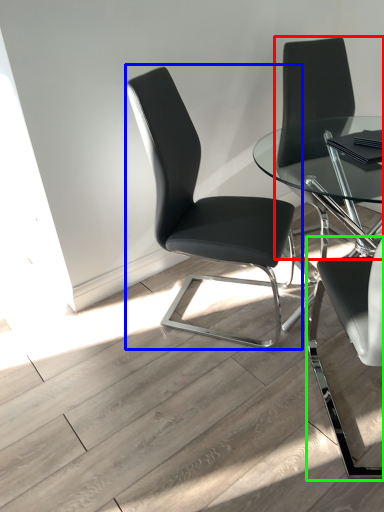
Question: Which object is the closest to the chair (highlighted by a red box)? Choose among these: chair (highlighted by a blue box) or chair (highlighted by a green box).

Choices:
 (A) chair
 (B) chair

Answer: (A)